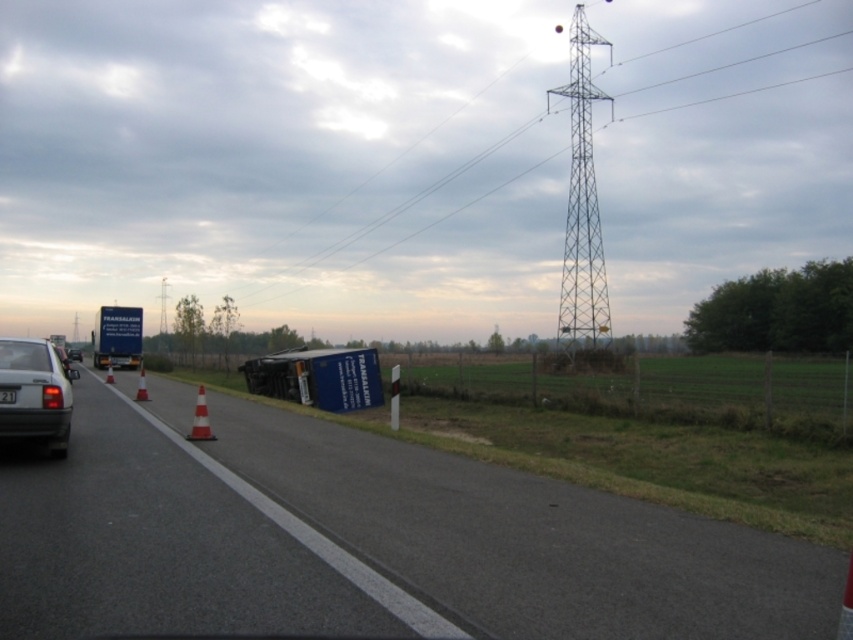
Question: Which object appears closest to the camera in this image?

Choices:
 (A) silver metallic sedan at left
 (B) matte gray sedan at left

Answer: (B)

Question: Is matte gray sedan at left wider than black plastic license plate at center?

Choices:
 (A) yes
 (B) no

Answer: (A)

Question: Which of the following is the closest to the observer?

Choices:
 (A) white striped cone at road center
 (B) smooth asphalt road at center
 (C) metallic grid tower at upper right

Answer: (B)

Question: Can you confirm if metallic grid tower at upper right is positioned to the right of silver metallic sedan at left?

Choices:
 (A) yes
 (B) no

Answer: (A)

Question: Which of the following is the closest to the observer?

Choices:
 (A) (111, 380)
 (B) (61, 349)
 (C) (13, 401)

Answer: (C)

Question: Does metallic grid tower at upper right have a greater width compared to orange/white striped cone at road center?

Choices:
 (A) yes
 (B) no

Answer: (A)